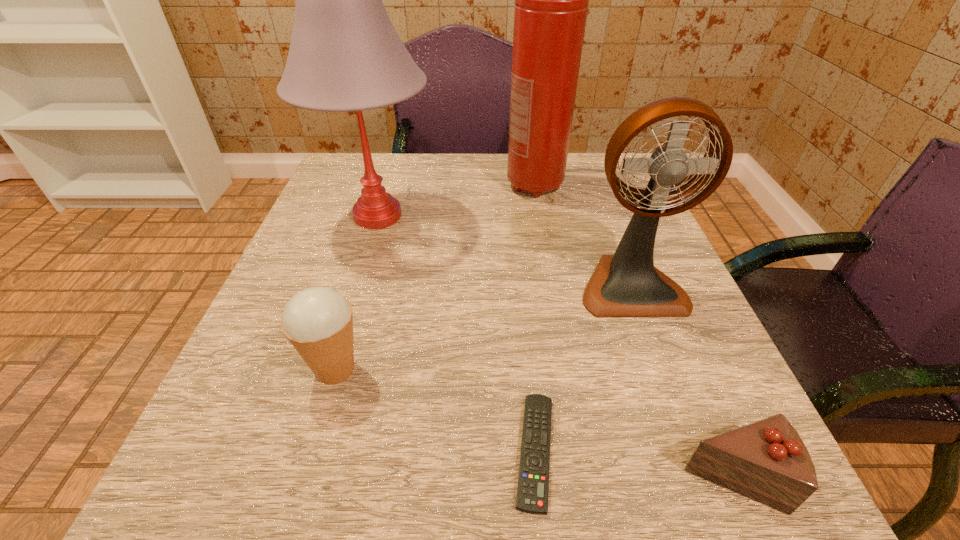
Locate an element on the screen. fan that is positioned at the right edge is located at coordinates (627, 284).

The image size is (960, 540). Identify the location of chocolate cake present at the right edge. (767, 461).

Locate an element on the screen. This screenshot has width=960, height=540. object at the far left corner is located at coordinates (345, 55).

Where is `object that is at the near right corner`? The image size is (960, 540). object that is at the near right corner is located at coordinates (767, 461).

Locate an element on the screen. This screenshot has height=540, width=960. vacant space at the far edge is located at coordinates (431, 161).

Where is `vacant space at the near edge of the desktop`? The width and height of the screenshot is (960, 540). vacant space at the near edge of the desktop is located at coordinates (328, 464).

The width and height of the screenshot is (960, 540). Identify the location of vacant space at the left edge. (318, 285).

This screenshot has width=960, height=540. What are the coordinates of `vacant space at the right edge of the desktop` in the screenshot? It's located at (694, 336).

Where is `free space at the far left corner of the desktop`? Image resolution: width=960 pixels, height=540 pixels. free space at the far left corner of the desktop is located at coordinates (359, 173).

The width and height of the screenshot is (960, 540). Identify the location of vacant region at the far right corner. (599, 158).